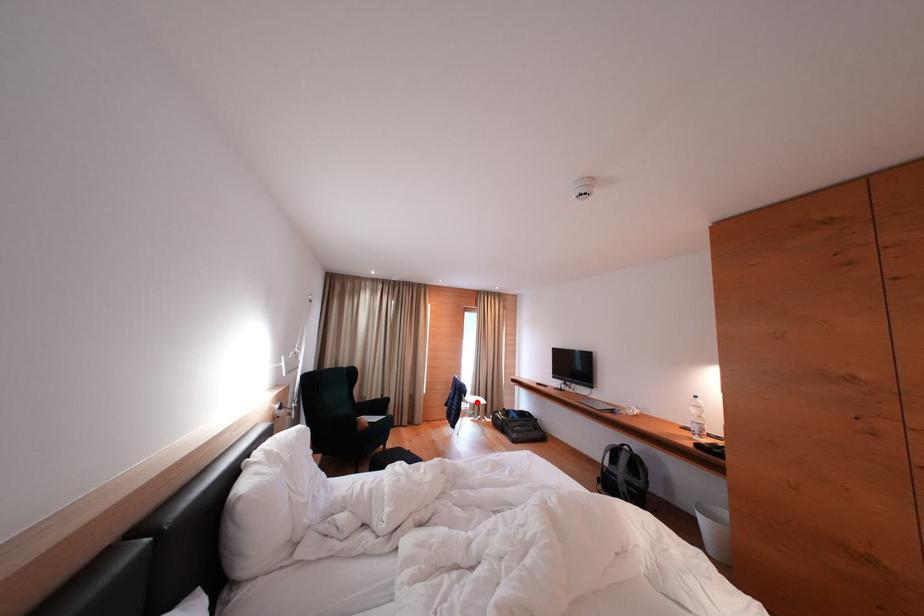
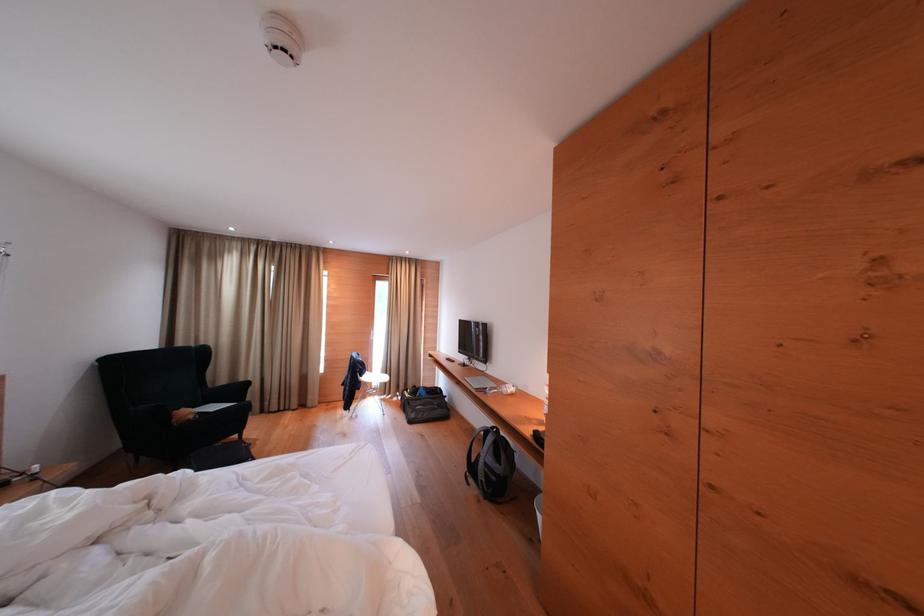
Question: I am providing you with two images of the same scene from different viewpoints. Given a red point in image1, look at the same physical point in image2. Is it:

Choices:
 (A) Closer to the viewpoint
 (B) Farther from the viewpoint

Answer: (A)